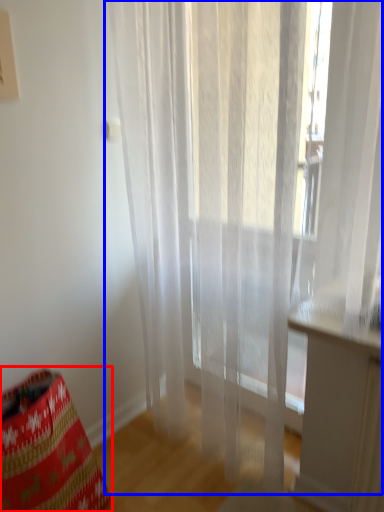
Question: Which of the following is the farthest to the observer, bean bag chair (highlighted by a red box) or curtain (highlighted by a blue box)?

Choices:
 (A) bean bag chair
 (B) curtain

Answer: (A)